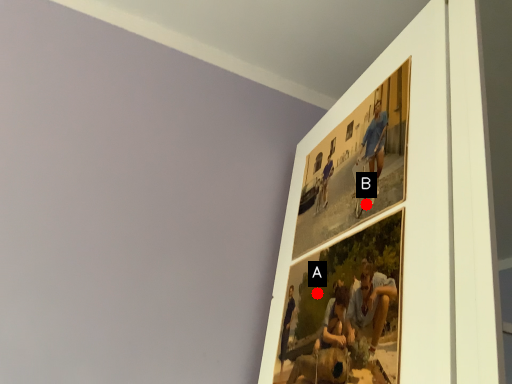
Question: Two points are circled on the image, labeled by A and B beside each circle. Which point appears farthest from the camera in this image?

Choices:
 (A) A is further
 (B) B is further

Answer: (A)